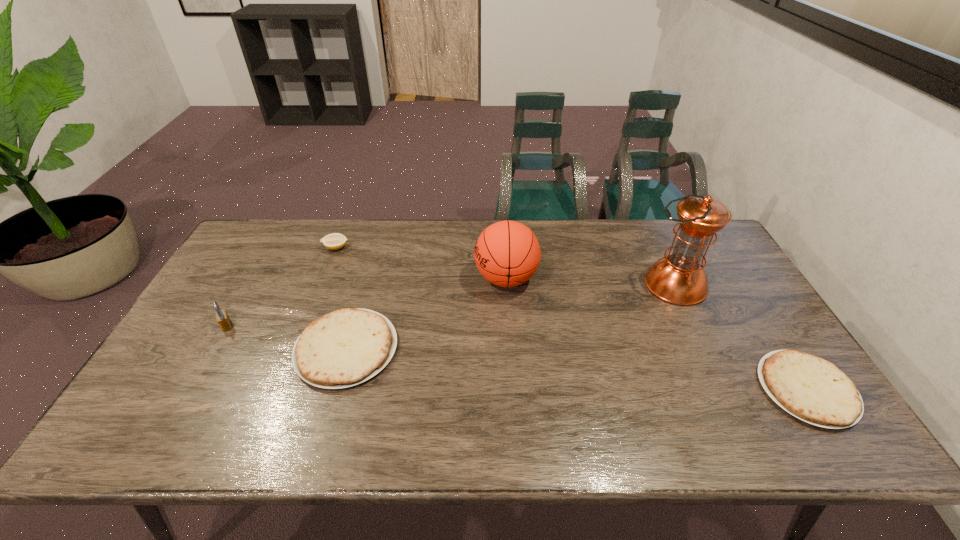
At what (x,y) coordinates should I click in order to perform the action: click on unoccupied area between the left tortilla and the oil lamp. Please return your answer as a coordinate pair (x, y). This screenshot has width=960, height=540. Looking at the image, I should click on (511, 316).

Identify the location of empty space between the tallest object and the third tallest object. (450, 305).

This screenshot has height=540, width=960. Find the location of `free space between the lemon and the shortest object`. free space between the lemon and the shortest object is located at coordinates (571, 319).

Where is `free space that is in between the shortest object and the third tallest object`? free space that is in between the shortest object and the third tallest object is located at coordinates (516, 357).

This screenshot has width=960, height=540. In order to click on empty space between the taller tortilla and the right tortilla in this screenshot , I will do `click(576, 369)`.

Locate an element on the screen. This screenshot has width=960, height=540. free spot between the basketball and the padlock is located at coordinates (367, 302).

Where is `free spot between the taller tortilla and the farthest object`? This screenshot has width=960, height=540. free spot between the taller tortilla and the farthest object is located at coordinates (342, 298).

I want to click on free space between the left tortilla and the right tortilla, so click(576, 369).

Identify which object is located as the fourth nearest to the tallest object. Please provide its 2D coordinates. Your answer should be formatted as a tuple, i.e. [(x, y)], where the tuple contains the x and y coordinates of a point satisfying the conditions above.

[(334, 241)]

Select which object appears as the fourth closest to the lemon. Please provide its 2D coordinates. Your answer should be formatted as a tuple, i.e. [(x, y)], where the tuple contains the x and y coordinates of a point satisfying the conditions above.

[(679, 279)]